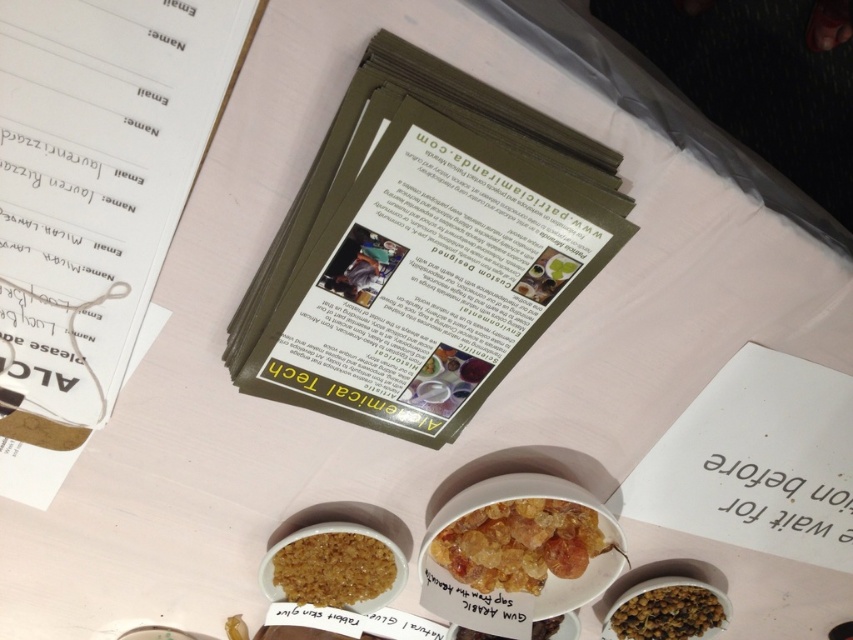
Can you confirm if translucent amber crystals at center is smaller than translucent amber cube at center?

No.

Does translucent amber crystals at center come behind translucent amber cube at center?

No, translucent amber crystals at center is in front of translucent amber cube at center.

Is point (538, 548) closer to viewer compared to point (531, 634)?

Yes, it is in front of point (531, 634).

Locate an element on the screen. The image size is (853, 640). translucent amber crystals at center is located at coordinates (520, 544).

Is white paper at upper left positioned behind translucent amber crystals at center?

No, white paper at upper left is in front of translucent amber crystals at center.

Is point (96, 147) less distant than point (476, 509)?

Yes.

Is point (33, 109) closer to camera compared to point (485, 547)?

Yes, point (33, 109) is in front of point (485, 547).

The width and height of the screenshot is (853, 640). I want to click on white paper at upper left, so 94,198.

Is white paper at upper left positioned in front of brown crumbly substance at center?

Yes, white paper at upper left is closer to the viewer.

Describe the element at coordinates (94, 198) in the screenshot. This screenshot has height=640, width=853. I see `white paper at upper left` at that location.

The height and width of the screenshot is (640, 853). What are the coordinates of `white paper at upper left` in the screenshot? It's located at (94, 198).